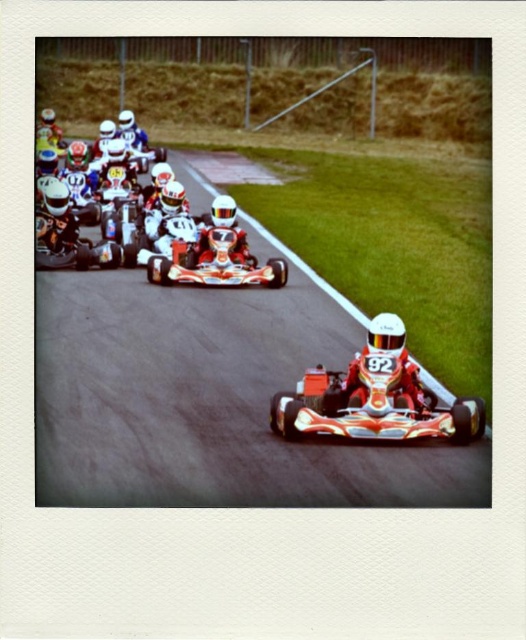
Image resolution: width=526 pixels, height=640 pixels. What do you see at coordinates (208, 401) in the screenshot?
I see `smooth asphalt race track at upper center` at bounding box center [208, 401].

How much distance is there between smooth asphalt race track at upper center and white glossy number at center?

The distance of smooth asphalt race track at upper center from white glossy number at center is 7.34 feet.

Looking at this image, who is more distant from viewer, (x=185, y=445) or (x=390, y=358)?

Point (x=390, y=358)

You are a GUI agent. You are given a task and a screenshot of the screen. Output one action in this format:
    pyautogui.click(x=<x>, y=<y>)
    Task: Click on the smooth asphalt race track at upper center
    The height and width of the screenshot is (640, 526).
    Given the screenshot: What is the action you would take?
    pyautogui.click(x=208, y=401)

Which of these two, shiny orange go-kart at center or shiny red helmet at center, stands shorter?

shiny orange go-kart at center

In order to click on shiny orange go-kart at center in this screenshot , I will do `click(215, 262)`.

Where is `shiny orange go-kart at center`? The width and height of the screenshot is (526, 640). shiny orange go-kart at center is located at coordinates (215, 262).

Can you confirm if shiny orange go-kart at center is smaller than white glossy number at center?

No.

Based on the photo, who is taller, shiny orange go-kart at center or white glossy number at center?

shiny orange go-kart at center is taller.

Consider the image. Who is more forward, (207,230) or (389,360)?

Point (389,360)

Where is `shiny orange go-kart at center`? This screenshot has width=526, height=640. shiny orange go-kart at center is located at coordinates (215, 262).